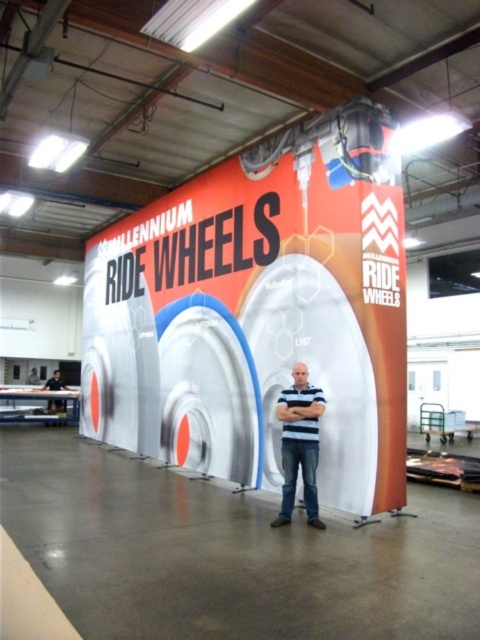
Is striped cotton shirt at center wider than blue striped shirt at center?

Correct, the width of striped cotton shirt at center exceeds that of blue striped shirt at center.

Can you confirm if striped cotton shirt at center is positioned above blue striped shirt at center?

Incorrect, striped cotton shirt at center is not positioned above blue striped shirt at center.

Is point (291, 388) positioned before point (317, 419)?

No, it is behind (317, 419).

Identify the location of striped cotton shirt at center. The image size is (480, 640). [x=300, y=444].

Is white glossy sign at center smaller than blue striped shirt at center?

Incorrect, white glossy sign at center is not smaller in size than blue striped shirt at center.

Where is `white glossy sign at center`? This screenshot has height=640, width=480. white glossy sign at center is located at coordinates (261, 314).

Identify the location of white glossy sign at center. (261, 314).

Which is below, white glossy sign at center or striped cotton shirt at center?

Positioned lower is striped cotton shirt at center.

Can you confirm if white glossy sign at center is taller than striped cotton shirt at center?

Yes.

Between point (227, 189) and point (312, 451), which one is positioned in front?

Point (312, 451)

You are a GUI agent. You are given a task and a screenshot of the screen. Output one action in this format:
    pyautogui.click(x=<x>, y=<y>)
    Task: Click on the white glossy sign at center
    The height and width of the screenshot is (640, 480).
    Given the screenshot: What is the action you would take?
    pyautogui.click(x=261, y=314)